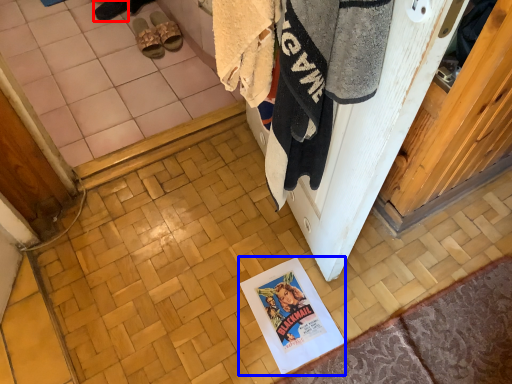
Question: Among these objects, which one is nearest to the camera, footwear (highlighted by a red box) or poster page (highlighted by a blue box)?

Choices:
 (A) footwear
 (B) poster page

Answer: (B)